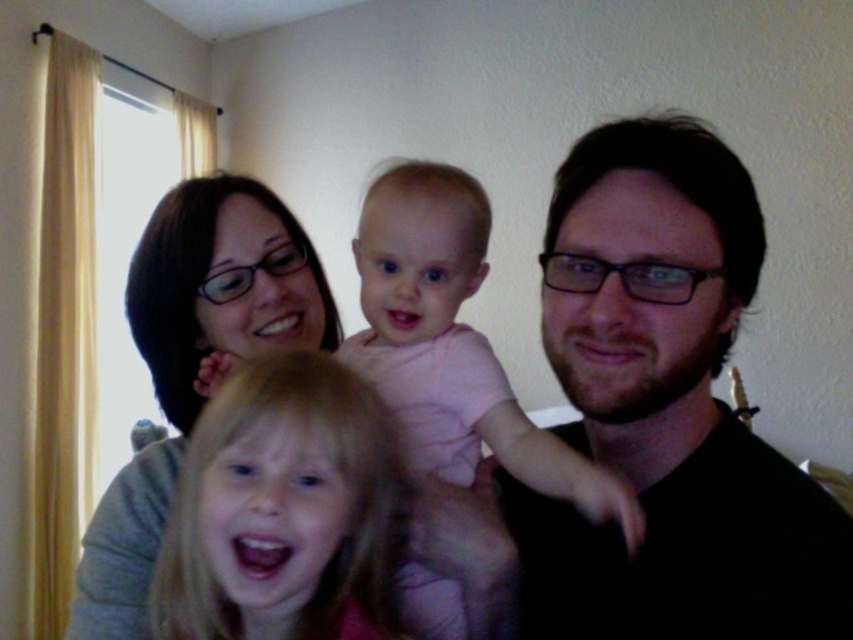
Question: Which of the following is the farthest from the observer?

Choices:
 (A) blonde hair at center
 (B) pink fabric baby at center
 (C) matte gray sweater at upper left

Answer: (C)

Question: Observing the image, what is the correct spatial positioning of blonde hair at center in reference to matte gray sweater at upper left?

Choices:
 (A) above
 (B) below

Answer: (B)

Question: Is blonde hair at center to the right of matte gray sweater at upper left from the viewer's perspective?

Choices:
 (A) yes
 (B) no

Answer: (A)

Question: In this image, where is blonde hair at center located relative to matte gray sweater at upper left?

Choices:
 (A) below
 (B) above

Answer: (A)

Question: Which of these objects is positioned farthest from the matte gray sweater at upper left?

Choices:
 (A) blonde hair at center
 (B) pink fabric baby at center

Answer: (A)

Question: Which object is the closest to the matte gray sweater at upper left?

Choices:
 (A) blonde hair at center
 (B) pink fabric baby at center

Answer: (B)